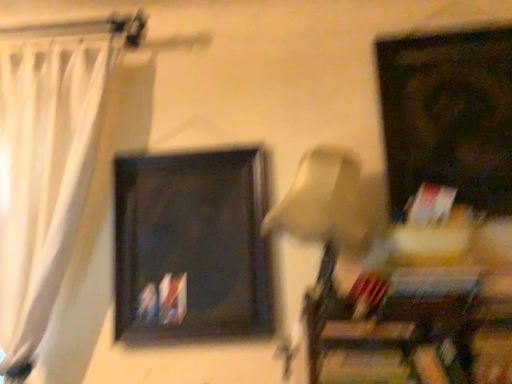
Question: From a real-world perspective, does matte black picture frame at upper right, which ranks as the 1th picture frame in right-to-left order, stand above beige fabric lampshade at center?

Choices:
 (A) yes
 (B) no

Answer: (A)

Question: Does matte black picture frame at upper right, which ranks as the 1th picture frame in right-to-left order, have a lesser width compared to beige fabric lampshade at center?

Choices:
 (A) no
 (B) yes

Answer: (B)

Question: Considering the relative positions of matte black picture frame at upper right, which ranks as the 1th picture frame in right-to-left order, and beige fabric lampshade at center in the image provided, is matte black picture frame at upper right, which ranks as the 1th picture frame in right-to-left order, to the left of beige fabric lampshade at center from the viewer's perspective?

Choices:
 (A) no
 (B) yes

Answer: (A)

Question: Is the depth of matte black picture frame at upper right, which ranks as the 1th picture frame in right-to-left order, greater than that of beige fabric lampshade at center?

Choices:
 (A) no
 (B) yes

Answer: (B)

Question: Can you confirm if matte black picture frame at upper right, which appears as the 2th picture frame when viewed from the left, is bigger than beige fabric lampshade at center?

Choices:
 (A) yes
 (B) no

Answer: (B)

Question: In the image, is matte black picture frame at upper right, which ranks as the 1th picture frame in right-to-left order, positioned in front of or behind white sheer curtain at left?

Choices:
 (A) behind
 (B) front

Answer: (A)

Question: Visually, is matte black picture frame at upper right, which appears as the 2th picture frame when viewed from the left, positioned to the left or to the right of white sheer curtain at left?

Choices:
 (A) left
 (B) right

Answer: (B)

Question: In terms of width, does matte black picture frame at upper right, which appears as the 2th picture frame when viewed from the left, look wider or thinner when compared to white sheer curtain at left?

Choices:
 (A) thin
 (B) wide

Answer: (A)

Question: Does point (499, 178) appear closer or farther from the camera than point (27, 228)?

Choices:
 (A) farther
 (B) closer

Answer: (B)

Question: Is white sheer curtain at left situated inside beige fabric lampshade at center or outside?

Choices:
 (A) outside
 (B) inside

Answer: (A)

Question: Looking at the image, does white sheer curtain at left seem bigger or smaller compared to beige fabric lampshade at center?

Choices:
 (A) big
 (B) small

Answer: (A)

Question: From the image's perspective, is white sheer curtain at left above or below beige fabric lampshade at center?

Choices:
 (A) above
 (B) below

Answer: (A)

Question: Considering the positions of white sheer curtain at left and beige fabric lampshade at center in the image, is white sheer curtain at left wider or thinner than beige fabric lampshade at center?

Choices:
 (A) wide
 (B) thin

Answer: (B)

Question: In terms of width, does beige fabric lampshade at center look wider or thinner when compared to white sheer curtain at left?

Choices:
 (A) thin
 (B) wide

Answer: (B)

Question: From the image's perspective, relative to white sheer curtain at left, is beige fabric lampshade at center above or below?

Choices:
 (A) below
 (B) above

Answer: (A)